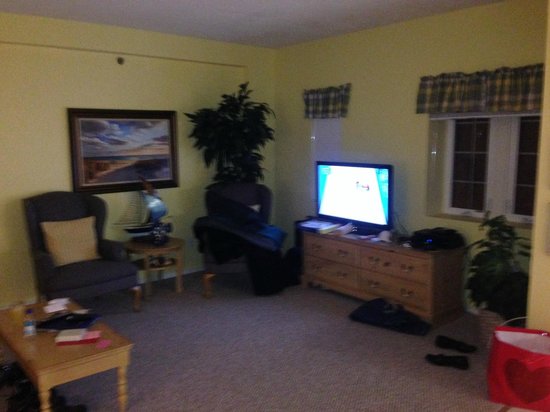
Find the location of a particular element. The height and width of the screenshot is (412, 550). bottle is located at coordinates (29, 327).